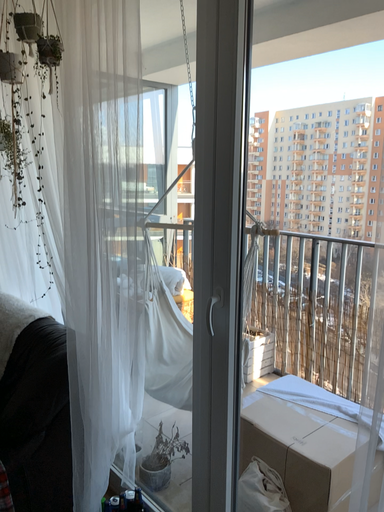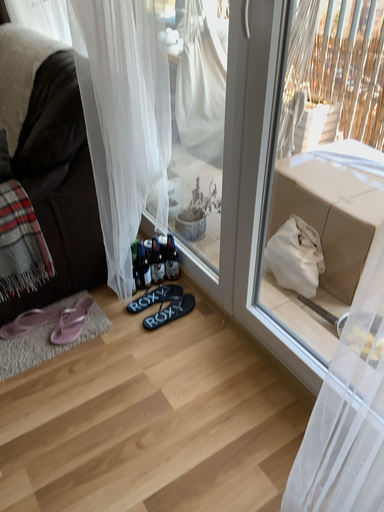
Question: Which way did the camera rotate in the video?

Choices:
 (A) rotated downward
 (B) rotated upward

Answer: (A)